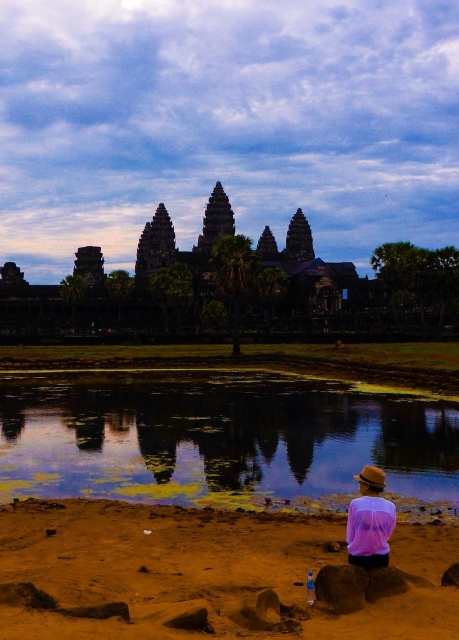
You are a tourist visiting Angkor Wat and see the green algae water at lower center and the pink sheer blouse at lower right in the scene. Which object is positioned higher in the image?

The green algae water at lower center is located above the pink sheer blouse at lower right, so it is positioned higher in the image.

In the scene shown: You are a tourist visiting Angkor Wat and want to take a photo of the temple reflection in the water. You notice the green algae water at lower center and the pink sheer blouse at lower right in your viewfinder. Which object is positioned higher in the frame?

The green algae water at lower center is much taller than the pink sheer blouse at lower right, so it is positioned higher in the frame.

You are standing at the edge of the brown sandy beach at lower right and want to place a pink sheer blouse at lower right on the beach. Can the beach accommodate the blouse without it hanging off the edge?

The brown sandy beach at lower right might be wider than the pink sheer blouse at lower right, so there is a possibility that the blouse can fit on the beach without hanging off the edge. However, the exact dimensions are uncertain based on the given information.